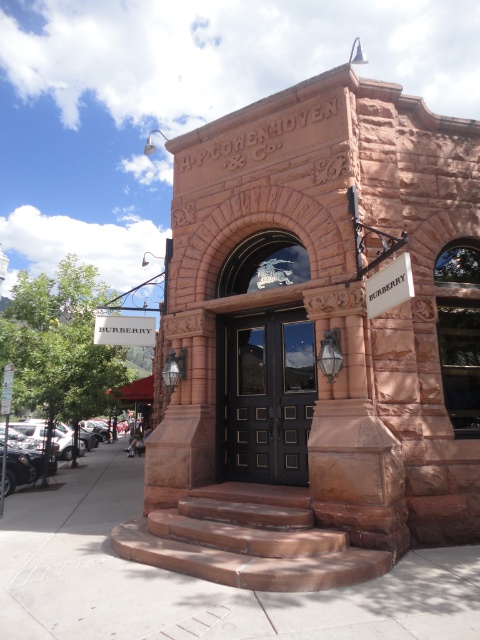
Question: Is brown stone stairs at center thinner than black polished wood door at center?

Choices:
 (A) no
 (B) yes

Answer: (A)

Question: Which point is farther to the camera?

Choices:
 (A) click(291, 540)
 (B) click(94, 609)
 (C) click(10, 371)
 (D) click(220, 433)

Answer: (C)

Question: From the image, what is the correct spatial relationship of brown stone stairs at center in relation to white plastic street sign at lower left?

Choices:
 (A) above
 (B) below

Answer: (B)

Question: Which of the following is the farthest from the observer?

Choices:
 (A) (305, 349)
 (B) (218, 493)
 (C) (10, 401)
 (D) (68, 563)

Answer: (C)

Question: Does brown stone stairs at center appear on the left side of black polished wood door at center?

Choices:
 (A) no
 (B) yes

Answer: (B)

Question: Which is nearer to the brown stone stairs at center?

Choices:
 (A) black polished wood door at center
 (B) smooth concrete pavement at center

Answer: (B)